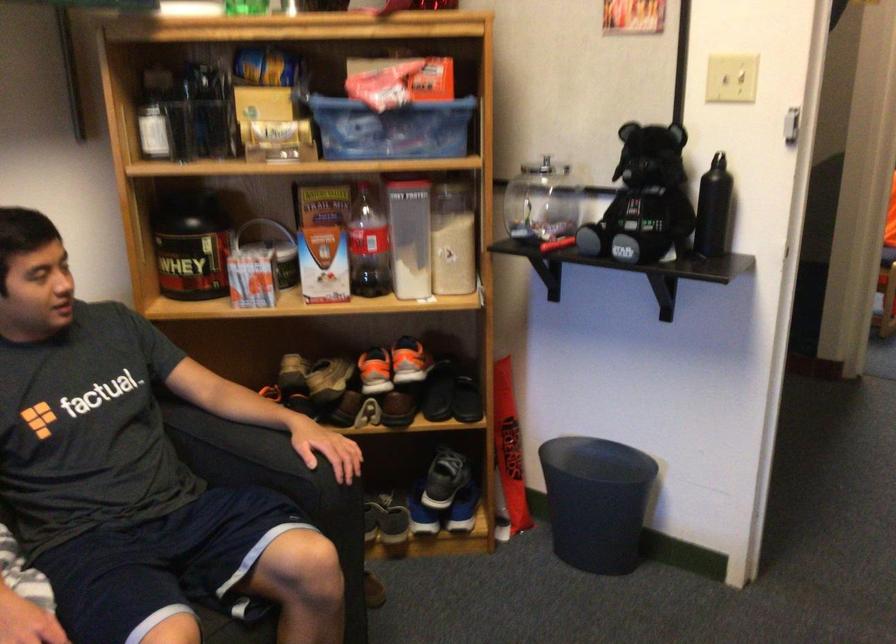
Image resolution: width=896 pixels, height=644 pixels. What do you see at coordinates (237, 605) in the screenshot?
I see `the sofa sitting surface` at bounding box center [237, 605].